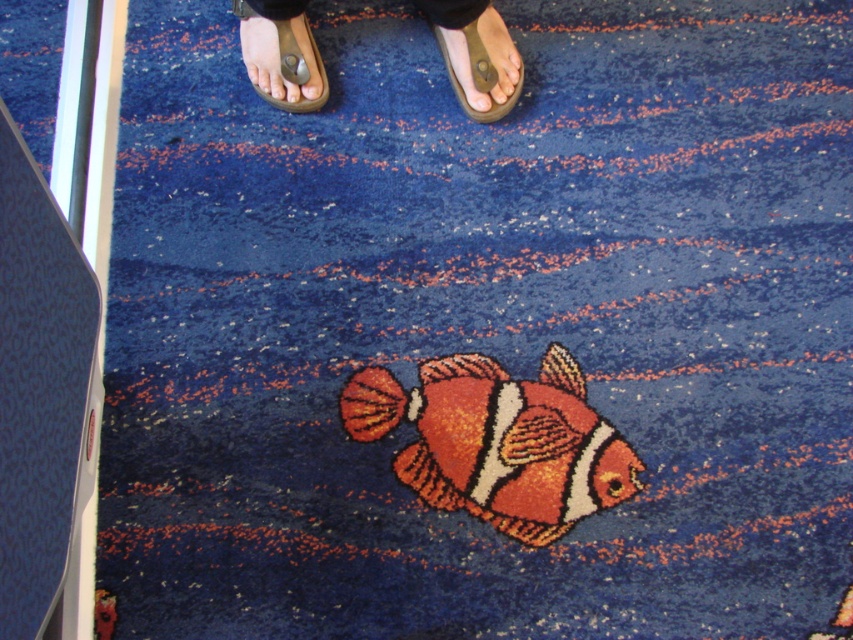
Does orange felt clown fish at center have a greater height compared to matte brown flip-flop at upper center?

Correct, orange felt clown fish at center is much taller as matte brown flip-flop at upper center.

Describe the element at coordinates (498, 442) in the screenshot. This screenshot has height=640, width=853. I see `orange felt clown fish at center` at that location.

I want to click on orange felt clown fish at center, so click(498, 442).

Locate an element on the screen. orange felt clown fish at center is located at coordinates (498, 442).

Between orange felt clown fish at center and brown leather sandals at upper center, which one is positioned lower?

Positioned lower is orange felt clown fish at center.

Is point (422, 426) closer to camera compared to point (498, 97)?

Yes, point (422, 426) is in front of point (498, 97).

Image resolution: width=853 pixels, height=640 pixels. I want to click on orange felt clown fish at center, so click(x=498, y=442).

Between brown leather sandals at upper center and brown leather sandal at upper center, which one appears on the left side from the viewer's perspective?

Positioned to the left is brown leather sandals at upper center.

Does point (242, 56) come behind point (476, 44)?

Yes, it is.

What do you see at coordinates (476, 54) in the screenshot? The width and height of the screenshot is (853, 640). I see `brown leather sandals at upper center` at bounding box center [476, 54].

I want to click on brown leather sandals at upper center, so click(476, 54).